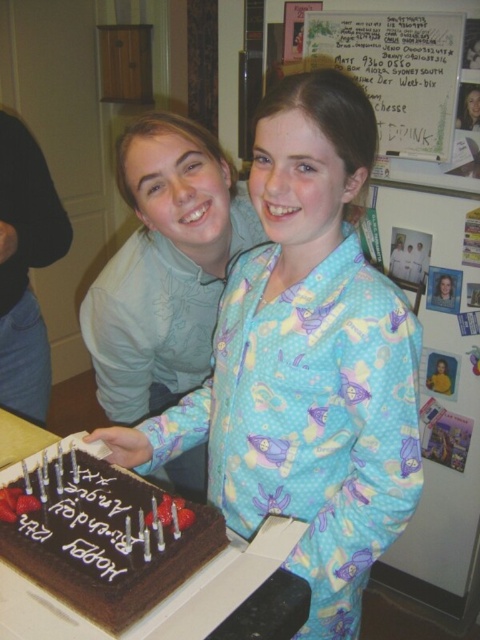
Does chocolatesmoothcake at center appear on the left side of white paper at upper center?

Correct, you'll find chocolatesmoothcake at center to the left of white paper at upper center.

Which is behind, point (131, 518) or point (446, 97)?

Positioned behind is point (446, 97).

What are the coordinates of `chocolatesmoothcake at center` in the screenshot? It's located at (103, 536).

How much distance is there between blue cotton pajamas at center and chocolatesmoothcake at center?

A distance of 8.99 inches exists between blue cotton pajamas at center and chocolatesmoothcake at center.

Who is lower down, blue cotton pajamas at center or chocolatesmoothcake at center?

chocolatesmoothcake at center

Who is more distant from viewer, (389, 358) or (199, 566)?

Positioned behind is point (199, 566).

I want to click on blue cotton pajamas at center, so click(305, 362).

In the scene shown: Who is more forward, (291, 298) or (455, 92)?

Point (291, 298)

Does blue cotton pajamas at center appear on the left side of white paper at upper center?

Correct, you'll find blue cotton pajamas at center to the left of white paper at upper center.

This screenshot has width=480, height=640. I want to click on blue cotton pajamas at center, so pyautogui.click(x=305, y=362).